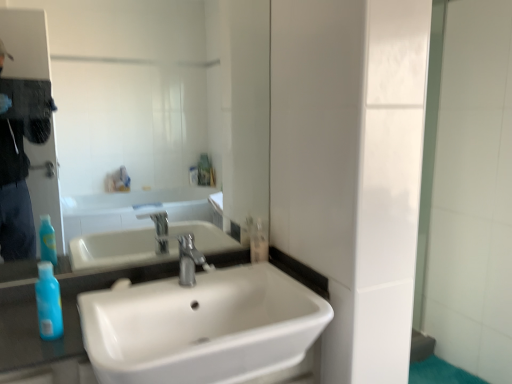
Find the location of `vacant location behind silver metallic faucet at center`. vacant location behind silver metallic faucet at center is located at coordinates (213, 268).